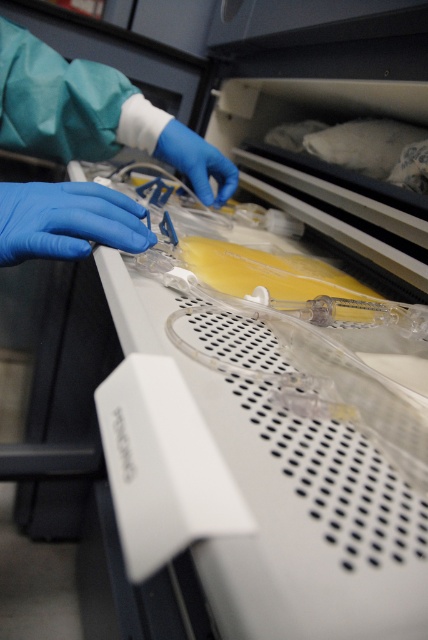
Between blue latex gloves at upper left and blue rubber glove at left, which one is positioned higher?

blue latex gloves at upper left

Who is more distant from viewer, [58,189] or [9,204]?

The point [58,189] is more distant.

Find the location of `blue latex gloves at upper left`. blue latex gloves at upper left is located at coordinates 92,115.

Where is `blue latex gloves at upper left`? Image resolution: width=428 pixels, height=640 pixels. blue latex gloves at upper left is located at coordinates (92, 115).

Is blue rubber glove at left to the left of blue latex glove at center from the viewer's perspective?

Yes, blue rubber glove at left is to the left of blue latex glove at center.

What do you see at coordinates (67, 220) in the screenshot? I see `blue rubber glove at left` at bounding box center [67, 220].

The image size is (428, 640). What are the coordinates of `blue rubber glove at left` in the screenshot? It's located at (67, 220).

Is blue latex gloves at upper left bigger than blue latex glove at center?

Correct, blue latex gloves at upper left is larger in size than blue latex glove at center.

Which of these two, blue latex gloves at upper left or blue latex glove at center, stands taller?

blue latex gloves at upper left

Describe the element at coordinates (92, 115) in the screenshot. The width and height of the screenshot is (428, 640). I see `blue latex gloves at upper left` at that location.

Where is `blue latex gloves at upper left`? This screenshot has height=640, width=428. blue latex gloves at upper left is located at coordinates (92, 115).